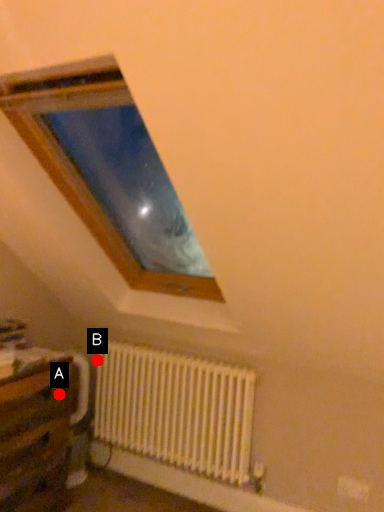
Question: Two points are circled on the image, labeled by A and B beside each circle. Which point is closer to the camera?

Choices:
 (A) A is closer
 (B) B is closer

Answer: (A)